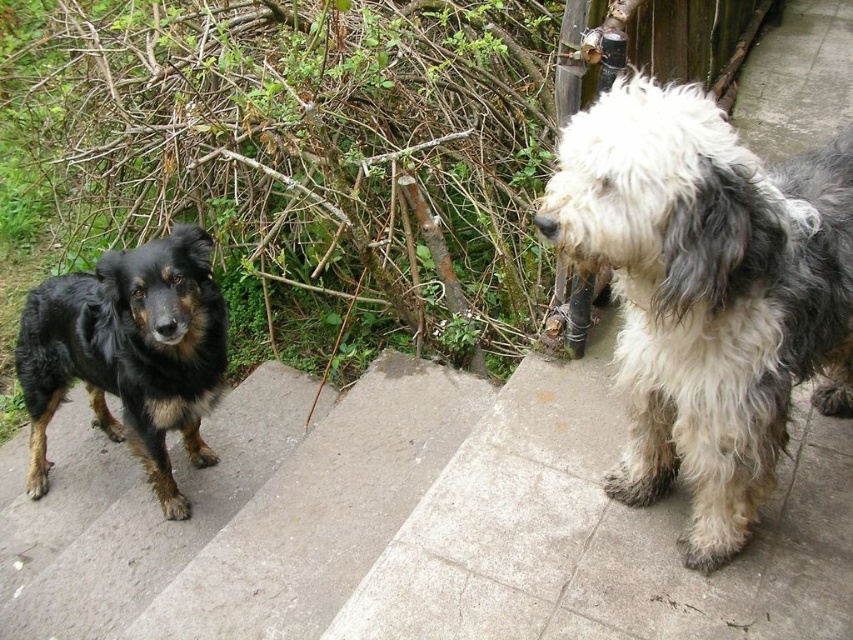
You are a small robot with a width of 12 inches. You need to move from the concrete stairs at lower left to the shaggy black dog at left. Can you fit through the space between them?

The distance between the concrete stairs at lower left and the shaggy black dog at left is 18.15 inches, which is wider than your 12 inch width. Yes, you can fit through the space between them.

You are a photographer trying to capture both the white and gray fluffy dog at upper right and the shaggy black dog at left in a single shot. Which dog should you focus on first to ensure both are in clear focus?

You should focus on the shaggy black dog at left first because it is farther away from the viewer than the white and gray fluffy dog at upper right, ensuring depth of field captures both.